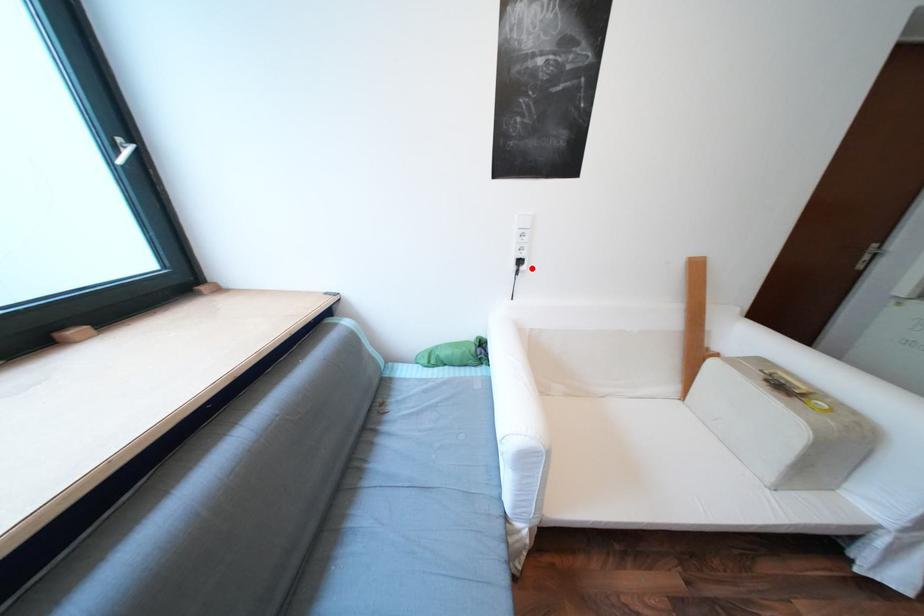
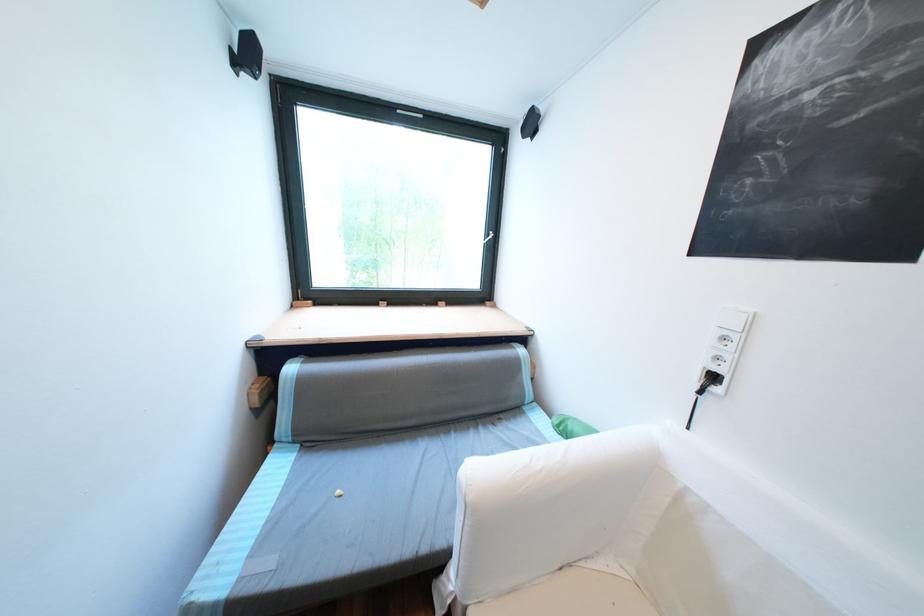
Find the pixel in the second image that matches the highlighted location in the first image.

(725, 390)